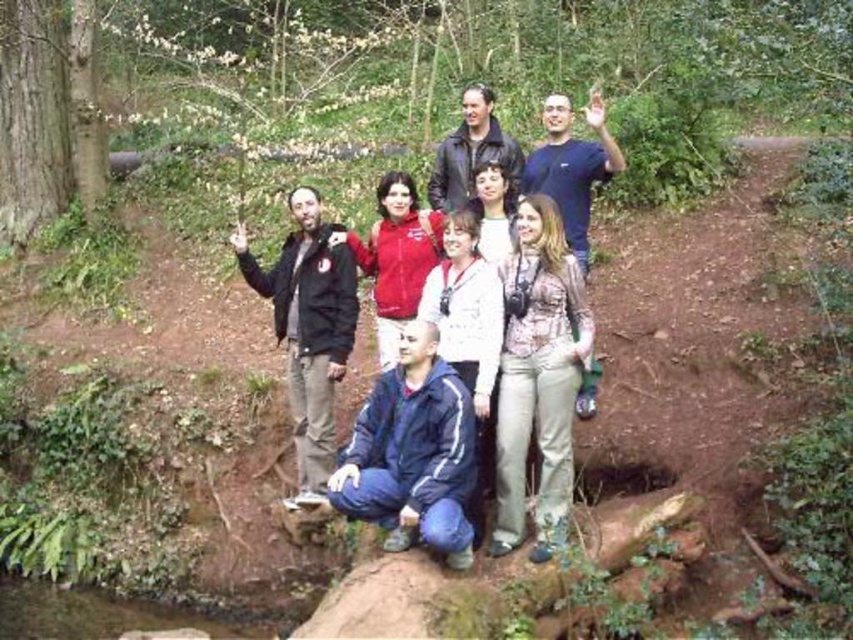
Question: Is matte red jacket at center wider than leather jacket at center?

Choices:
 (A) yes
 (B) no

Answer: (A)

Question: Which object is the farthest from the patterned fabric blouse at center?

Choices:
 (A) matte black jacket at center
 (B) leather jacket at center

Answer: (B)

Question: Which of these objects is positioned closest to the patterned fabric blouse at center?

Choices:
 (A) camouflage-patterned shirt at center
 (B) black matte jacket at left
 (C) blue fabric jacket at center

Answer: (C)

Question: Is matte red jacket at center smaller than camouflage-patterned shirt at center?

Choices:
 (A) no
 (B) yes

Answer: (B)

Question: Which of these objects is positioned closest to the matte black jacket at center?

Choices:
 (A) camouflage-patterned shirt at center
 (B) black matte jacket at left
 (C) patterned fabric blouse at center

Answer: (C)

Question: Can you confirm if patterned fabric blouse at center is positioned to the left of camouflage-patterned shirt at center?

Choices:
 (A) no
 (B) yes

Answer: (B)